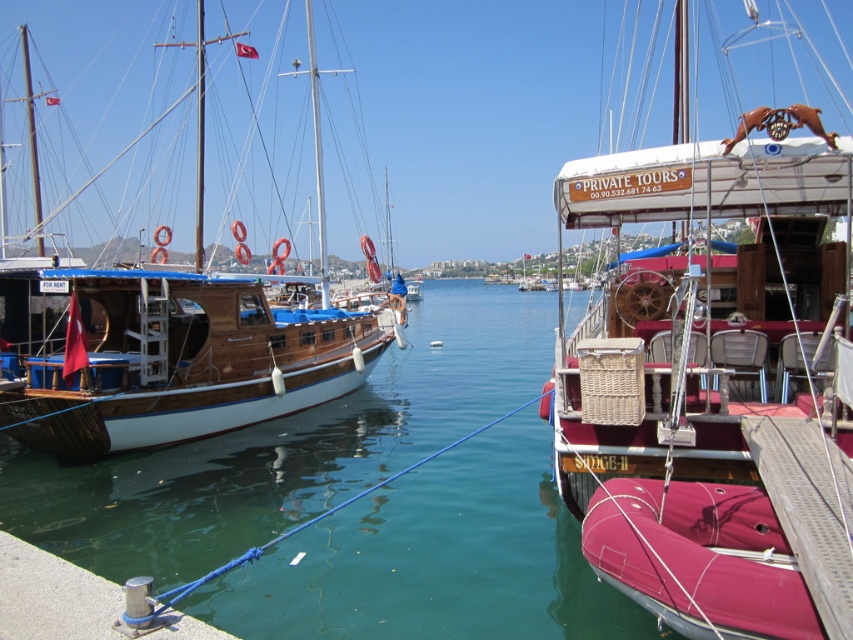
Based on the photo, you are a photographer planning to take a photo of the green water at center and the wooden sailboat at left. Which object will appear taller in the photo?

The wooden sailboat at left is taller than the green water at center in the photo.

You are a photographer standing at the pier and want to take a photo of the wooden sailboat at center and the green water at center. Based on their positions, which object will appear closer to the camera in the photo?

The wooden sailboat at center is in front of the green water at center, so it will appear closer to the camera in the photo.

You are planning a private tour and need to choose between the wooden sailboat at center and the wooden sailboat at left. Based on the scene description, which boat offers more space for passengers?

The wooden sailboat at center is bigger than the wooden sailboat at left, so it offers more space for passengers.